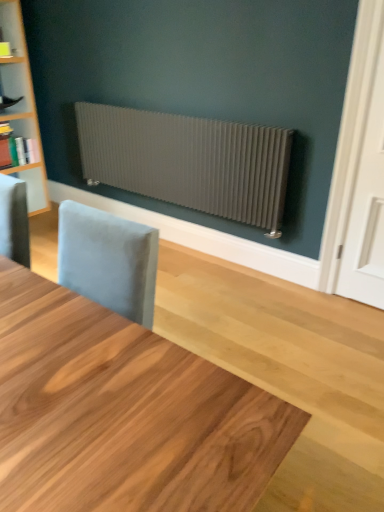
What do you see at coordinates (27, 131) in the screenshot?
I see `matte white bookshelf at left` at bounding box center [27, 131].

Locate an element on the screen. The width and height of the screenshot is (384, 512). light wood table at center is located at coordinates (123, 413).

From a real-world perspective, is light wood table at center on top of matte white bookshelf at left?

No, from a real-world perspective, light wood table at center is not above matte white bookshelf at left.

Can you confirm if light wood table at center is shorter than matte white bookshelf at left?

Yes, light wood table at center is shorter than matte white bookshelf at left.

Choose the correct answer: Is light wood table at center inside satin silver radiator at upper center or outside it?

The correct answer is: outside.

How many degrees apart are the facing directions of light wood table at center and satin silver radiator at upper center?

The facing directions of light wood table at center and satin silver radiator at upper center are 90.1 degrees apart.

Considering the relative sizes of light wood table at center and satin silver radiator at upper center in the image provided, is light wood table at center thinner than satin silver radiator at upper center?

No, light wood table at center is not thinner than satin silver radiator at upper center.

From a real-world perspective, relative to satin silver radiator at upper center, is light wood table at center vertically above or below?

light wood table at center is below satin silver radiator at upper center.

How many degrees apart are the facing directions of satin silver radiator at upper center and light wood table at center?

The facing directions of satin silver radiator at upper center and light wood table at center are 90.1 degrees apart.

Is satin silver radiator at upper center closer to the viewer compared to light wood table at center?

That is False.

The width and height of the screenshot is (384, 512). I want to click on radiator located behind the light wood table at center, so click(x=188, y=161).

Is point (106, 138) more distant than point (179, 419)?

Yes.

Consider the image. Which of these two, satin silver radiator at upper center or matte white bookshelf at left, is thinner?

satin silver radiator at upper center.

Find the location of a particular element. The image size is (384, 512). radiator on the right of the matte white bookshelf at left is located at coordinates [x=188, y=161].

Is satin silver radiator at upper center in front of matte white bookshelf at left?

Yes, it is.

Consider the image. Considering the relative sizes of matte white bookshelf at left and satin silver radiator at upper center in the image provided, is matte white bookshelf at left wider than satin silver radiator at upper center?

Indeed, matte white bookshelf at left has a greater width compared to satin silver radiator at upper center.

Which object is further away from the camera taking this photo, matte white bookshelf at left or satin silver radiator at upper center?

matte white bookshelf at left is more distant.

Between matte white bookshelf at left and satin silver radiator at upper center, which one has more height?

satin silver radiator at upper center is taller.

From the image's perspective, which one is positioned lower, matte white bookshelf at left or satin silver radiator at upper center?

satin silver radiator at upper center, from the image's perspective.

Image resolution: width=384 pixels, height=512 pixels. What are the coordinates of `shelf behind the light wood table at center` in the screenshot? It's located at (27, 131).

Consider the image. Does matte white bookshelf at left have a smaller size compared to light wood table at center?

Indeed, matte white bookshelf at left has a smaller size compared to light wood table at center.

Between matte white bookshelf at left and light wood table at center, which one has larger width?

light wood table at center.

The width and height of the screenshot is (384, 512). In order to click on shelf positioned vertically above the light wood table at center (from a real-world perspective) in this screenshot , I will do `click(27, 131)`.

This screenshot has height=512, width=384. Find the location of `table that is under the satin silver radiator at upper center (from a real-world perspective)`. table that is under the satin silver radiator at upper center (from a real-world perspective) is located at coordinates (123, 413).

Looking at this image, estimate the real-world distances between objects in this image. Which object is further from satin silver radiator at upper center, light wood table at center or matte white bookshelf at left?

light wood table at center is further to satin silver radiator at upper center.

From the image, which object appears to be farther from light wood table at center, matte white bookshelf at left or satin silver radiator at upper center?

Among the two, matte white bookshelf at left is located further to light wood table at center.

Which object lies nearer to the anchor point matte white bookshelf at left, satin silver radiator at upper center or light wood table at center?

satin silver radiator at upper center is positioned closer to the anchor matte white bookshelf at left.

When comparing their distances from satin silver radiator at upper center, does matte white bookshelf at left or light wood table at center seem further?

Based on the image, light wood table at center appears to be further to satin silver radiator at upper center.

From the image, which object appears to be farther from light wood table at center, satin silver radiator at upper center or matte white bookshelf at left?

matte white bookshelf at left is positioned further to the anchor light wood table at center.

Looking at the image, which one is located further to matte white bookshelf at left, light wood table at center or satin silver radiator at upper center?

Based on the image, light wood table at center appears to be further to matte white bookshelf at left.

Where is `radiator between light wood table at center and matte white bookshelf at left along the z-axis`? radiator between light wood table at center and matte white bookshelf at left along the z-axis is located at coordinates (188, 161).